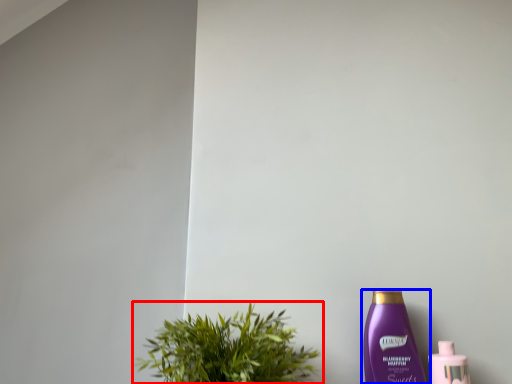
Question: Which of the following is the closest to the observer, houseplant (highlighted by a red box) or bottle (highlighted by a blue box)?

Choices:
 (A) houseplant
 (B) bottle

Answer: (A)